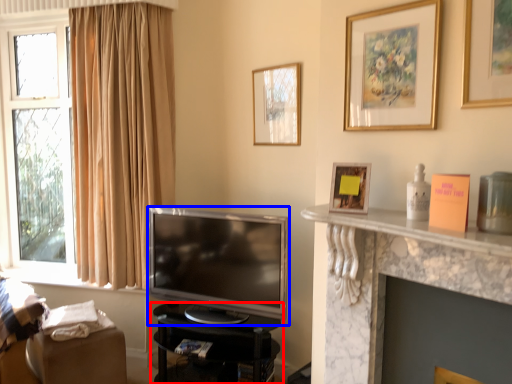
Question: Which point is further to the camera, furniture (highlighted by a red box) or television (highlighted by a blue box)?

Choices:
 (A) furniture
 (B) television

Answer: (A)